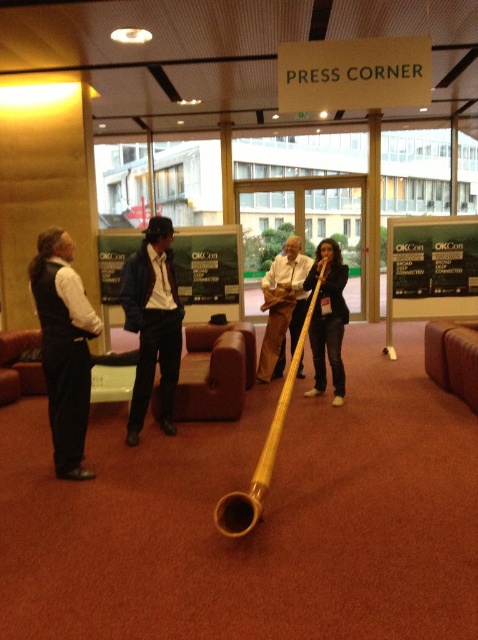
Does point (338, 259) lie behind point (247, 516)?

Yes, point (338, 259) is farther from viewer.

Is point (315, 340) positioned before point (218, 500)?

No, it is behind (218, 500).

Identify the location of wooden horn at center. This screenshot has width=478, height=640. (327, 317).

This screenshot has height=640, width=478. I want to click on black glossy bulletin board at center, so click(432, 266).

Between point (435, 248) and point (254, 513), which one is positioned behind?

Point (435, 248)

At what (x,y) coordinates should I click in order to perform the action: click on black glossy bulletin board at center. Please return your answer as a coordinate pair (x, y). Image resolution: width=478 pixels, height=640 pixels. Looking at the image, I should click on (432, 266).

Is green matte/blackboard at center below wooden horn at center?

Actually, green matte/blackboard at center is above wooden horn at center.

Which of these two, green matte/blackboard at center or wooden horn at center, stands shorter?

With less height is green matte/blackboard at center.

Locate an element on the screen. The height and width of the screenshot is (640, 478). green matte/blackboard at center is located at coordinates (208, 272).